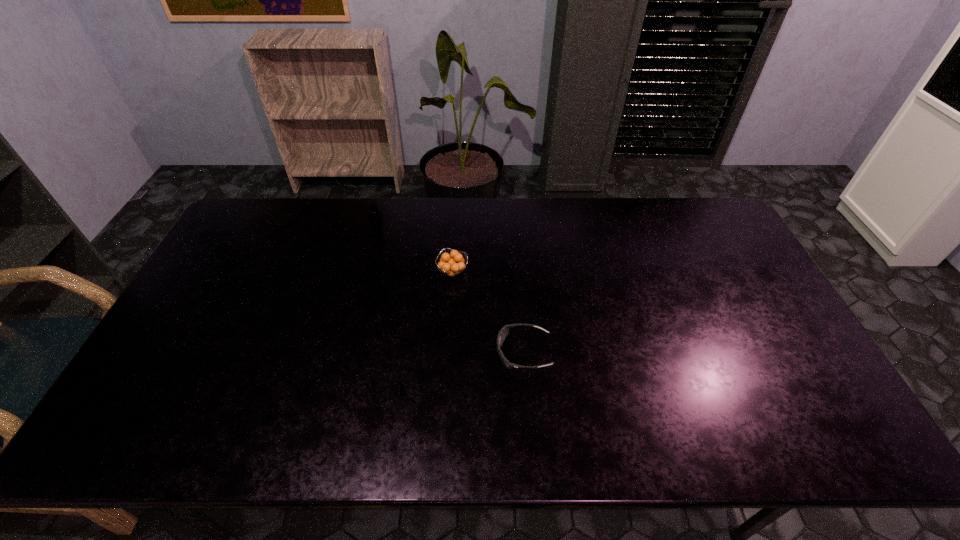
At what (x,y) coordinates should I click in order to perform the action: click on vacant area located 0.190m on the lenses of the shortest object. Please return your answer as a coordinate pair (x, y). This screenshot has width=960, height=540. Looking at the image, I should click on (426, 352).

Find the location of `object situated at the far edge`. object situated at the far edge is located at coordinates (375, 217).

This screenshot has width=960, height=540. In the image, there is a desktop. Find the location of `vacant area at the far edge`. vacant area at the far edge is located at coordinates (483, 215).

Locate an element on the screen. The width and height of the screenshot is (960, 540). free point at the near edge is located at coordinates (588, 437).

At what (x,y) coordinates should I click in order to perform the action: click on free location at the left edge. Please return your answer as a coordinate pair (x, y). Looking at the image, I should click on (221, 286).

Locate an element on the screen. The image size is (960, 540). vacant space at the right edge of the desktop is located at coordinates (707, 261).

Image resolution: width=960 pixels, height=540 pixels. I want to click on blank space at the far right corner, so click(677, 212).

Locate an element on the screen. This screenshot has width=960, height=540. vacant area that lies between the second tallest object and the farthest object is located at coordinates (415, 249).

Locate an element on the screen. empty location between the second nearest object and the tallest object is located at coordinates (415, 249).

The height and width of the screenshot is (540, 960). Identify the location of vacant point located between the Lego and the nearest object. (450, 289).